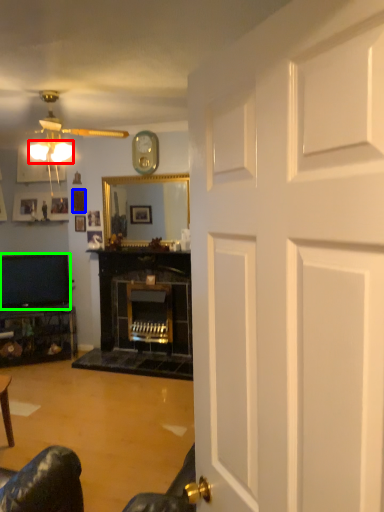
Question: Which object is the farthest from lamp (highlighted by a red box)? Choose among these: picture frame (highlighted by a blue box) or television (highlighted by a green box).

Choices:
 (A) picture frame
 (B) television

Answer: (B)